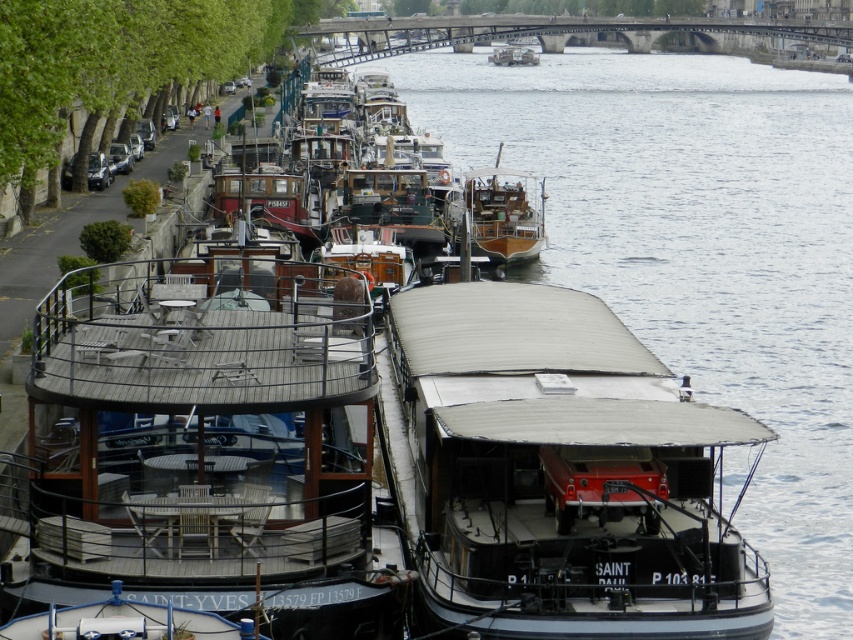
You are standing on the embankment next to the wooden deck boat at center. If you want to walk to the bridge in the background, which direction should you face?

Since the wooden deck boat at center is located at point [209,442], you should face towards the bridge in the background, which is positioned further back in the scene relative to the boat.

You are standing on the embankment near the houseboats and want to cross to the other side of the river. The point marked as point (699, 252) on the river surface is where the water is smoothest. Can you safely walk across the river using this point?

The smooth gray water at center is represented by point (699, 252). Since water surfaces are not solid ground, you cannot safely walk across the river using this point.

You are standing on the embankment near the houseboats and want to walk towards the bridge in the background. You notice two points marked on the ground at coordinates point (705, 269) and point (474, 237). Which point should you step on first to ensure you are moving towards the bridge?

You should step on point (474, 237) first because point (705, 269) is behind it, meaning point (474, 237) is closer to the bridge in the background.